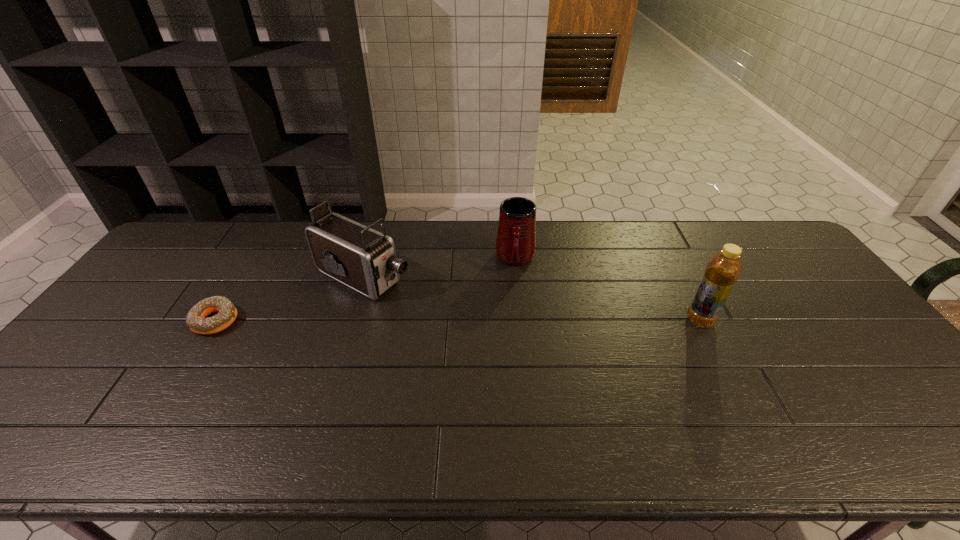
Select which object appears as the second closest to the shortest object. Please provide its 2D coordinates. Your answer should be formatted as a tuple, i.e. [(x, y)], where the tuple contains the x and y coordinates of a point satisfying the conditions above.

[(516, 237)]

Identify the location of object that is the closest one to the rightmost object. The image size is (960, 540). (516, 237).

The image size is (960, 540). I want to click on vacant region that satisfies the following two spatial constraints: 1. on the back side of the camcorder; 2. on the left side of the third tallest object, so click(x=370, y=259).

The width and height of the screenshot is (960, 540). Identify the location of vacant region that satisfies the following two spatial constraints: 1. on the back side of the doughnut; 2. on the left side of the bottle. (216, 320).

This screenshot has width=960, height=540. I want to click on vacant region that satisfies the following two spatial constraints: 1. on the back side of the camcorder; 2. on the left side of the second shortest object, so click(370, 259).